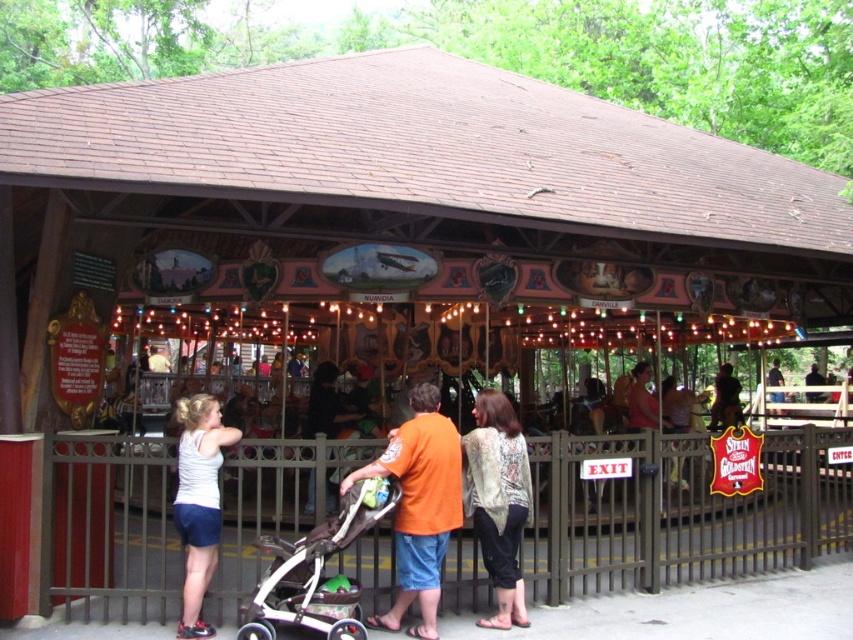
Question: Which object is the closest to the orange cotton shirt at center?

Choices:
 (A) white matte tank top at center
 (B) floral lace blouse at center

Answer: (B)

Question: Which of the following is the closest to the observer?

Choices:
 (A) black plastic baby carriage at center
 (B) white matte tank top at center
 (C) orange cotton shirt at center
 (D) floral lace blouse at center

Answer: (A)

Question: Is orange cotton shirt at center smaller than black plastic baby carriage at center?

Choices:
 (A) no
 (B) yes

Answer: (A)

Question: Which object is the closest to the orange cotton shirt at center?

Choices:
 (A) black plastic baby carriage at center
 (B) floral lace blouse at center
 (C) white matte tank top at center

Answer: (B)

Question: Where is orange cotton shirt at center located in relation to white matte tank top at center in the image?

Choices:
 (A) below
 (B) above

Answer: (B)

Question: From the image, what is the correct spatial relationship of black plastic baby carriage at center in relation to white matte tank top at center?

Choices:
 (A) left
 (B) right

Answer: (B)